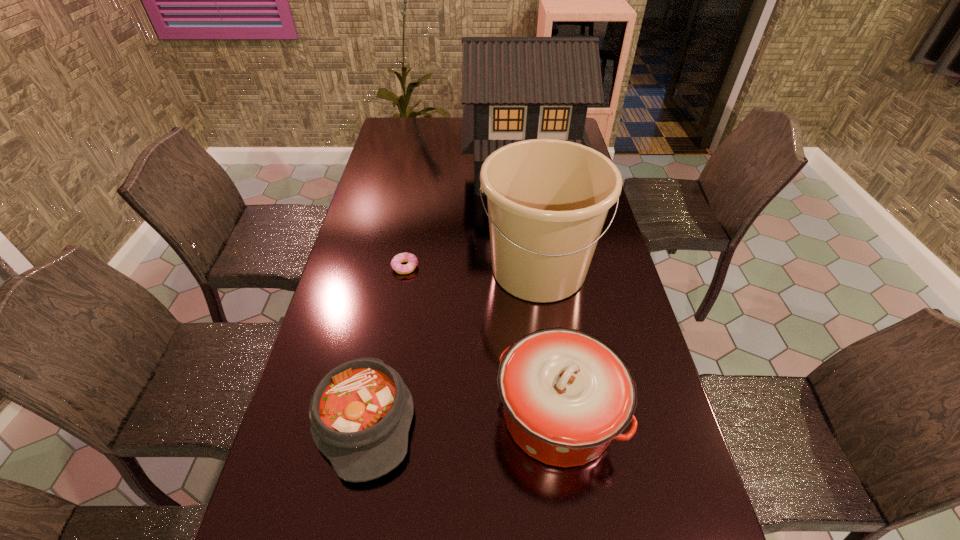
Locate an element on the screen. vacant space at the left edge of the desktop is located at coordinates (383, 177).

The height and width of the screenshot is (540, 960). In the image, there is a desktop. What are the coordinates of `vacant space at the right edge` in the screenshot? It's located at (652, 429).

You are a GUI agent. You are given a task and a screenshot of the screen. Output one action in this format:
    pyautogui.click(x=<x>, y=<y>)
    Task: Click on the vacant region between the farthest object and the left casserole
    
    Given the screenshot: What is the action you would take?
    pyautogui.click(x=443, y=294)

Image resolution: width=960 pixels, height=540 pixels. In order to click on unoccupied area between the dollhouse and the doughnut in this screenshot , I will do `click(463, 218)`.

Identify the location of vacant area that lies between the shortest object and the tallest object. (463, 218).

The height and width of the screenshot is (540, 960). Identify the location of empty location between the shorter casserole and the bucket. (452, 344).

Identify the location of object that is the third closest to the shortest object. This screenshot has width=960, height=540. (x=514, y=88).

Choose which object is the nearest neighbor to the doughnut. Please provide its 2D coordinates. Your answer should be formatted as a tuple, i.e. [(x, y)], where the tuple contains the x and y coordinates of a point satisfying the conditions above.

[(548, 199)]

Identify the location of free space that satisfies the following two spatial constraints: 1. on the back side of the fourth shortest object; 2. on the left side of the shorter casserole. The height and width of the screenshot is (540, 960). 394,269.

The height and width of the screenshot is (540, 960). I want to click on free space that satisfies the following two spatial constraints: 1. on the front-facing side of the farthest object; 2. on the left side of the second tallest object, so click(x=533, y=269).